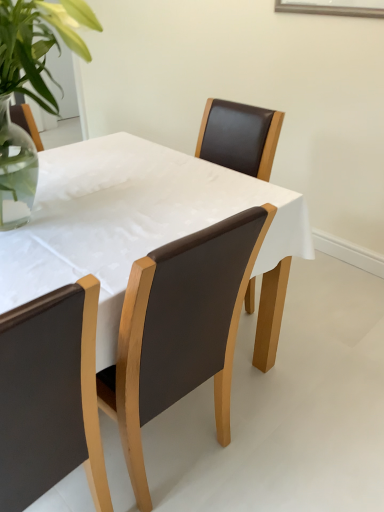
Identify the location of spots to the right of brown leather chair at center, acting as the 1th chair starting from the right. This screenshot has height=512, width=384. (276, 439).